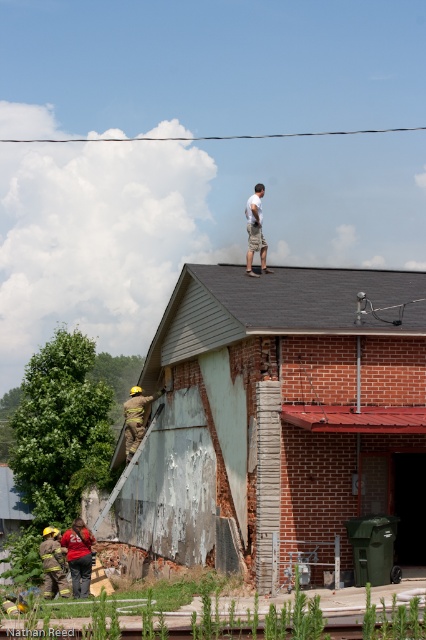
From the picture: You are a safety inspector at the construction site. You need to ensure that the distance between the peeling paint wall at lower left and the white cotton shirt at upper center is safe for workers. According to safety regulations, the minimum safe distance between a worker and a hazardous wall is 8 meters. Is the current distance compliant with the safety standards?

The peeling paint wall at lower left and the white cotton shirt at upper center are 9.18 meters apart from each other. Since 9.18 meters exceeds the minimum required 8 meters, the current distance complies with the safety standards.

You are a safety inspector assessing the construction site. You notice the peeling paint wall at lower left and the brushed metal helmet at lower left. Based on their positions, which object is higher from the ground?

The peeling paint wall at lower left is located above the brushed metal helmet at lower left, so the peeling paint wall at lower left is higher from the ground.